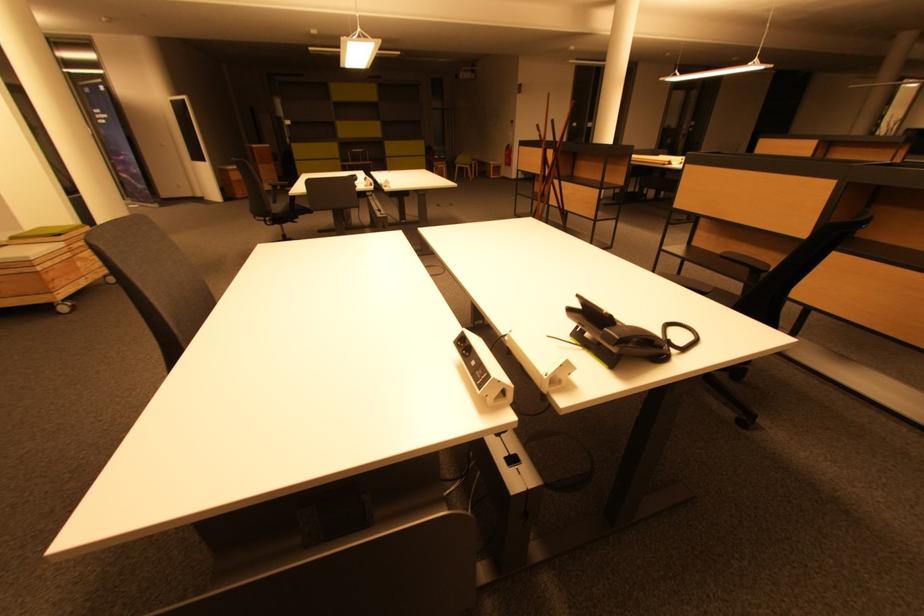
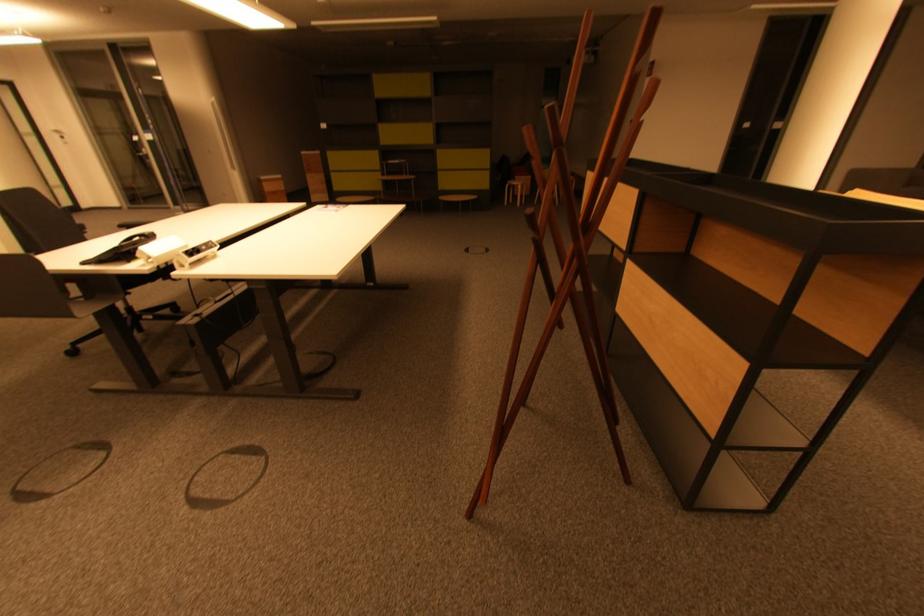
The images are taken continuously from a first-person perspective. In which direction are you moving?

The cameraman walked toward right, forward.